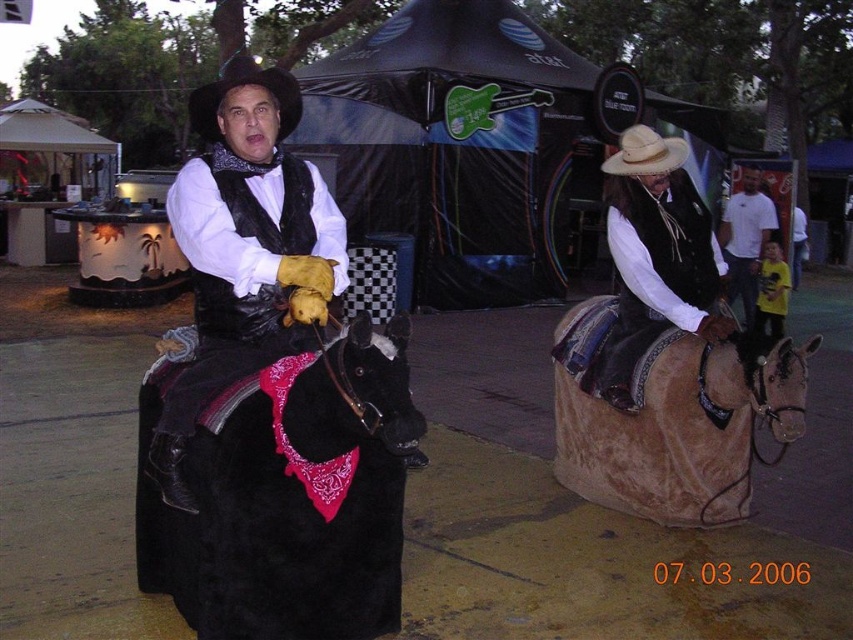
You are standing in the middle of the image and want to walk towards the point marked at coordinates (677, 424). Which direction should you go? Is there an object you need to avoid?

The point at (677, 424) is on the brown suede horse at right. You should walk towards the right side of the image to reach it. Be cautious of the mechanical horses and their riders as you move.

You are a photographer trying to capture the best angle of the two points in the image. Which point, point (364, 410) or point (210, 401), is closer to you?

Point (364, 410) is closer to the viewer than point (210, 401).

You are a photographer at the event and want to capture a photo where the black velvet horse at left is visible above the black leather vest at center. Is this possible based on their current positions?

The black velvet horse at left is currently below the black leather vest at center, so adjusting the camera angle or position might be needed to frame the horse above the vest in the photo.